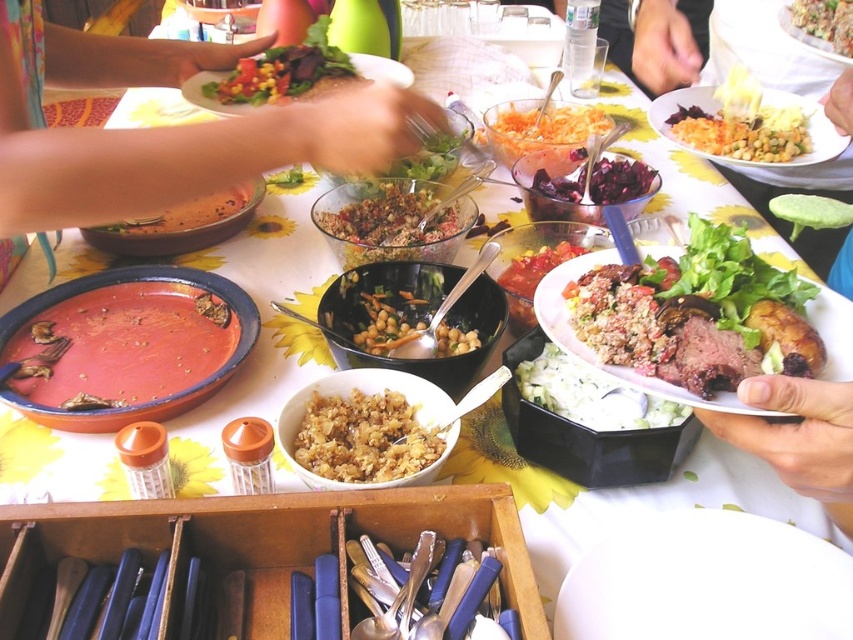
Question: Which object appears closest to the camera in this image?

Choices:
 (A) matte brown bowl at center-left
 (B) shiny purple grapes at center
 (C) tomato-based sauce at center
 (D) green rubber ring at center

Answer: (C)

Question: Can you confirm if smooth yellow pasta at upper right is thinner than multicolored grain salad at center?

Choices:
 (A) yes
 (B) no

Answer: (B)

Question: Among these points, which one is nearest to the camera?

Choices:
 (A) (465, 634)
 (B) (119, 227)

Answer: (A)

Question: Does rare beef steak at center appear over multicolored grain salad at center?

Choices:
 (A) no
 (B) yes

Answer: (A)

Question: Is rare beef steak at center thinner than vibrant mixed salad at center?

Choices:
 (A) no
 (B) yes

Answer: (B)

Question: Which of the following is the closest to the observer?

Choices:
 (A) smooth yellow pasta at upper right
 (B) carrot salad at center

Answer: (A)